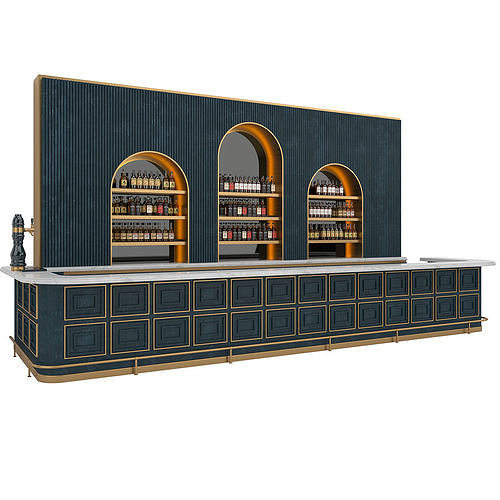
Image resolution: width=500 pixels, height=500 pixels. Identify the location of bottles on shelves in wall. (154, 214), (150, 232), (158, 185), (246, 185), (251, 211), (259, 233), (329, 198), (332, 213), (337, 232).